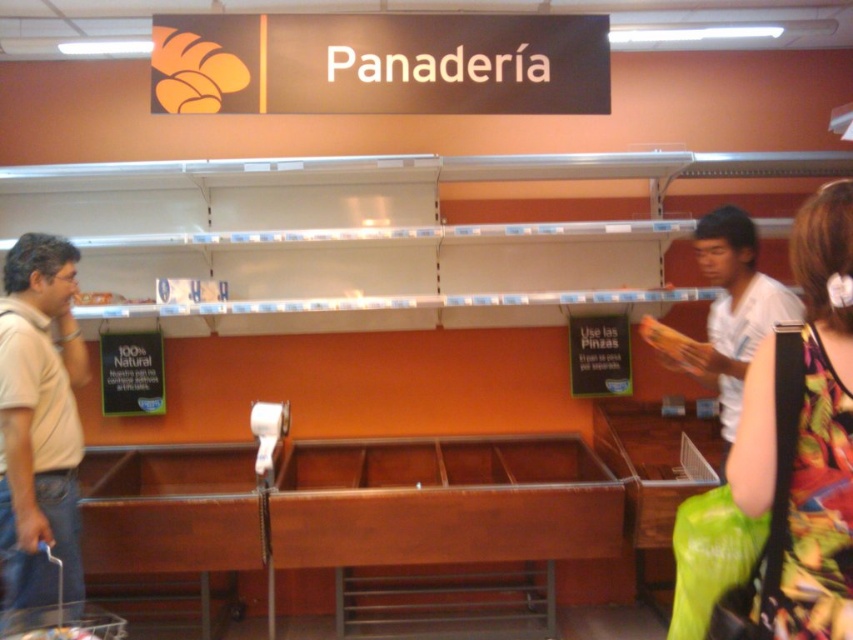
You are trying to decide which clothing item to try on first. The floral fabric dress at lower right and the white cotton shirt at right are both on your list. Based on their sizes, which one might be easier to find your size for?

The floral fabric dress at lower right is smaller than the white cotton shirt at right, so it might be easier to find your size for the floral fabric dress at lower right since smaller items often have more available sizes.

You are trying to decide between the floral fabric dress at lower right and the beige cotton shirt at left. Which item is narrower?

The floral fabric dress at lower right is narrower than the beige cotton shirt at left.

You are trying to find the beige cotton shirt at left and the white cotton shirt at right in a store. Which one is closer to you?

The beige cotton shirt at left is closer to you because it is in front of the white cotton shirt at right.